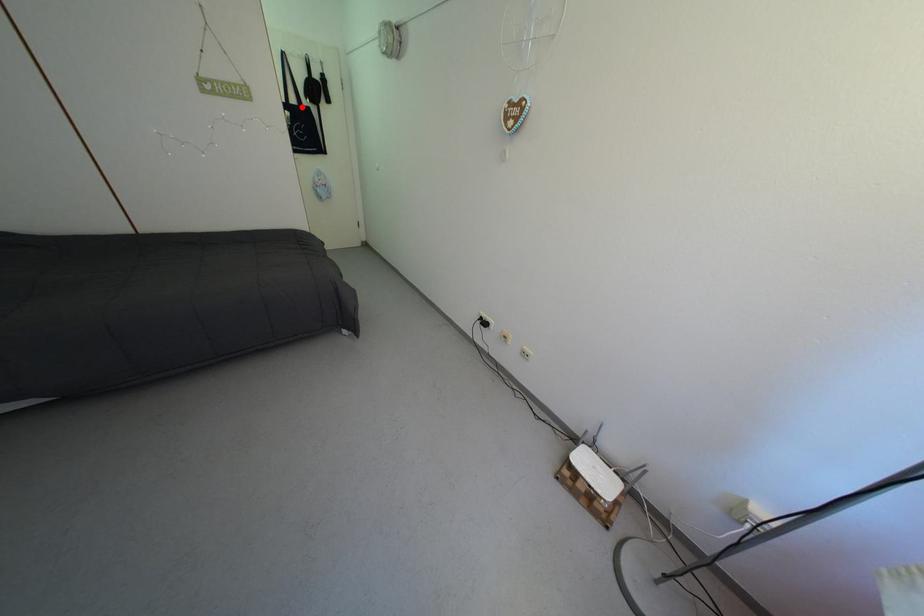
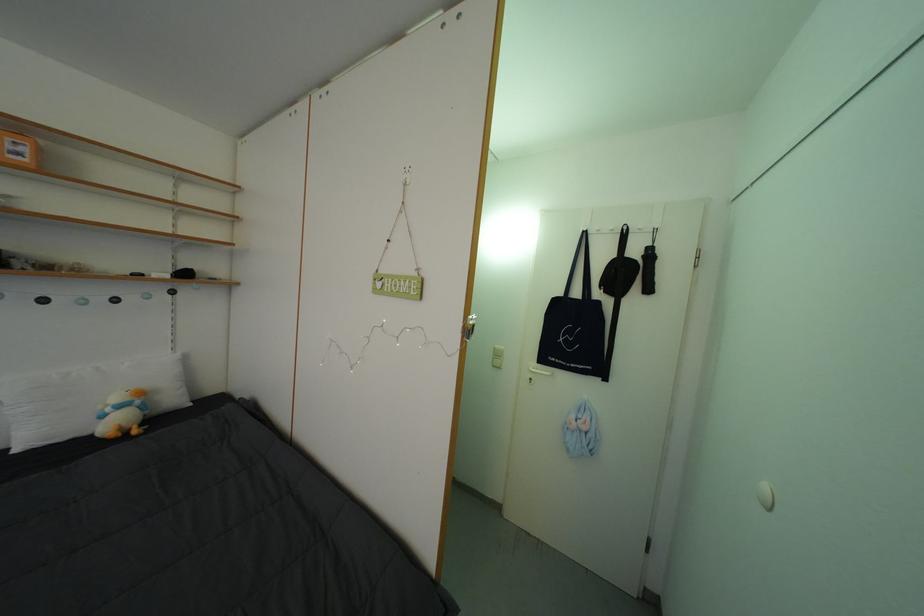
The point at the highlighted location is marked in the first image. Where is the corresponding point in the second image?

(586, 300)